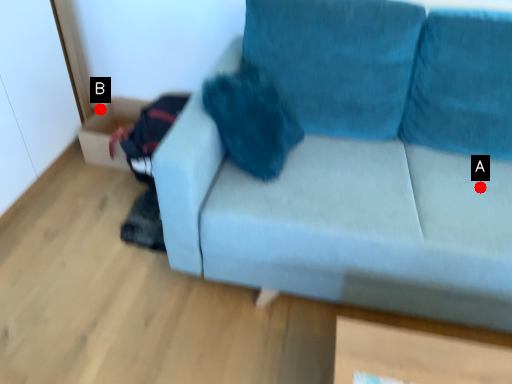
Question: Two points are circled on the image, labeled by A and B beside each circle. Which point is farther from the camera taking this photo?

Choices:
 (A) A is further
 (B) B is further

Answer: (B)